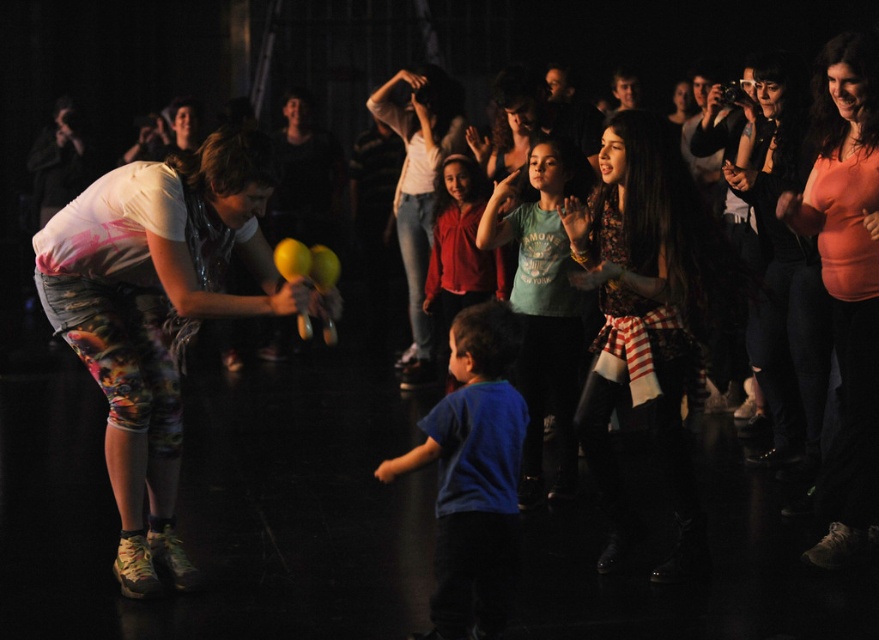
Is printed leggings at left wider than matte red shirt at center?

Indeed, printed leggings at left has a greater width compared to matte red shirt at center.

Is point (162, 433) farther from viewer compared to point (463, 236)?

No, it is not.

Is point (251, 253) closer to viewer compared to point (496, 260)?

Yes, it is.

Locate an element on the screen. printed leggings at left is located at coordinates [156, 314].

Does printed leggings at left appear over orange matte shirt at upper right?

Incorrect, printed leggings at left is not positioned above orange matte shirt at upper right.

Who is more distant from viewer, (106, 456) or (861, 506)?

Positioned behind is point (861, 506).

Where is `printed leggings at left`? The image size is (879, 640). printed leggings at left is located at coordinates (156, 314).

In the scene shown: Is blue matte shirt at center to the right of matte pink shirt at upper right from the viewer's perspective?

In fact, blue matte shirt at center is to the left of matte pink shirt at upper right.

Is blue matte shirt at center below matte pink shirt at upper right?

Yes.

Between point (471, 464) and point (774, 65), which one is positioned behind?

The point (774, 65) is more distant.

Locate an element on the screen. blue matte shirt at center is located at coordinates (473, 476).